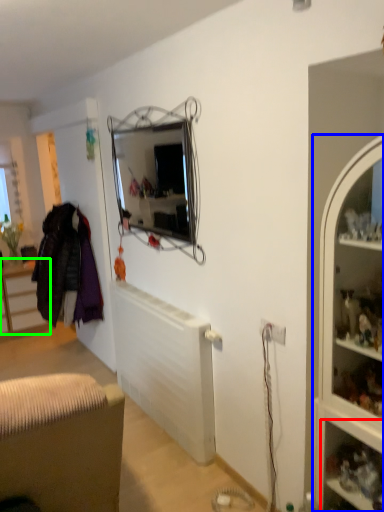
Question: Which is farther away from shelf (highlighted by a red box)? cabinet (highlighted by a blue box) or cabinetry (highlighted by a green box)?

Choices:
 (A) cabinet
 (B) cabinetry

Answer: (B)